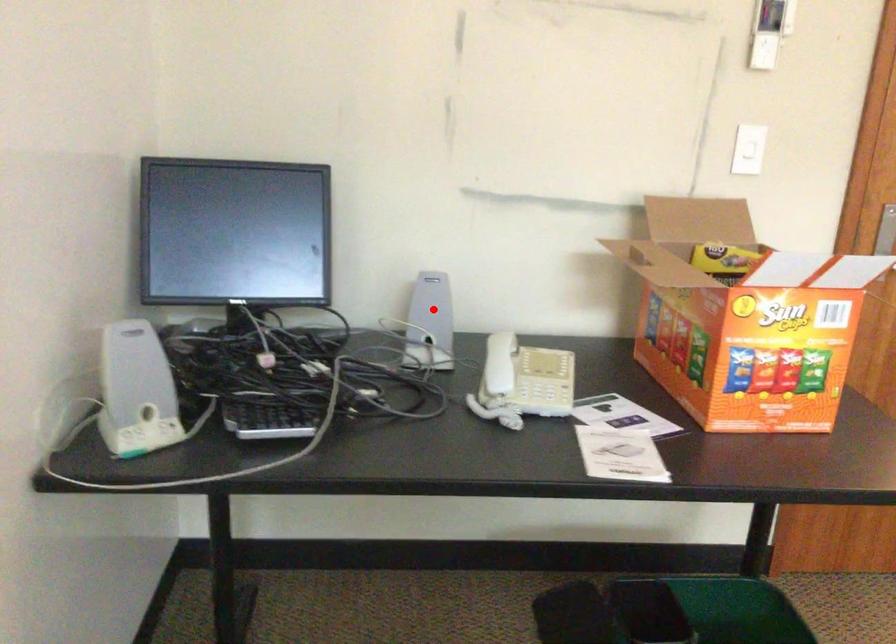
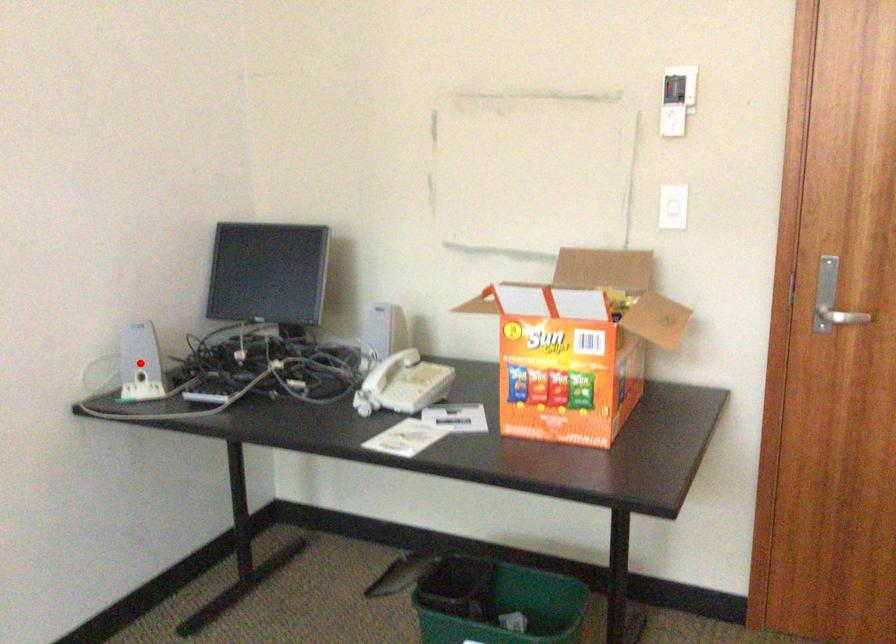
I am providing you with two images of the same scene from different viewpoints. A red point is marked on the first image and another point is marked on the second image. Is the red point in image1 aligned with the point shown in image2?

No